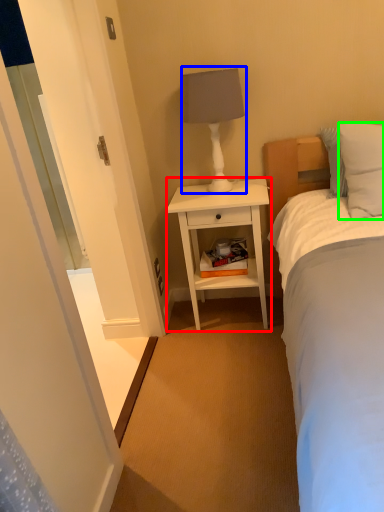
Question: Which object is the closest to the nightstand (highlighted by a red box)? Choose among these: table lamp (highlighted by a blue box) or pillow (highlighted by a green box).

Choices:
 (A) table lamp
 (B) pillow

Answer: (A)